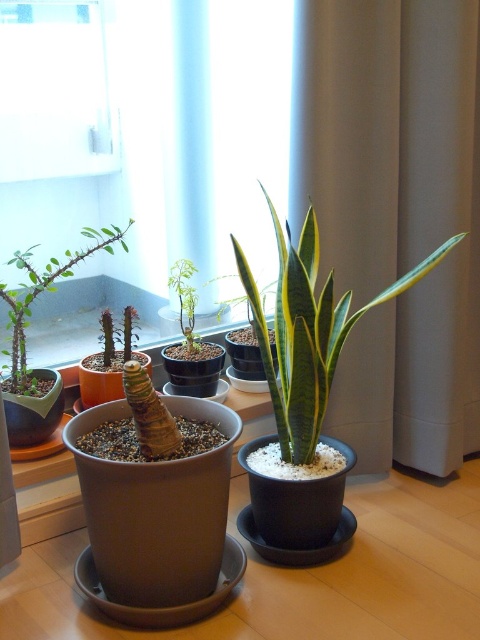
You are a gardener who wants to water the green matte succulent at left and the green matte plant at center. Which one should you water first if you want to avoid getting water on the other plant?

You should water the green matte succulent at left first because it is in front of the green matte plant at center, so watering it first would prevent water from dripping onto the plant behind it.